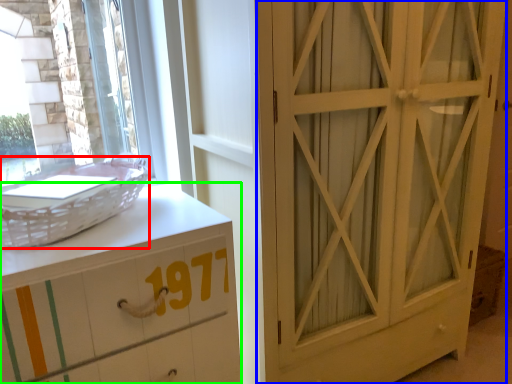
Question: Based on their relative distances, which object is nearer to basket (highlighted by a red box)? Choose from door (highlighted by a blue box) and chest of drawers (highlighted by a green box).

Choices:
 (A) door
 (B) chest of drawers

Answer: (B)